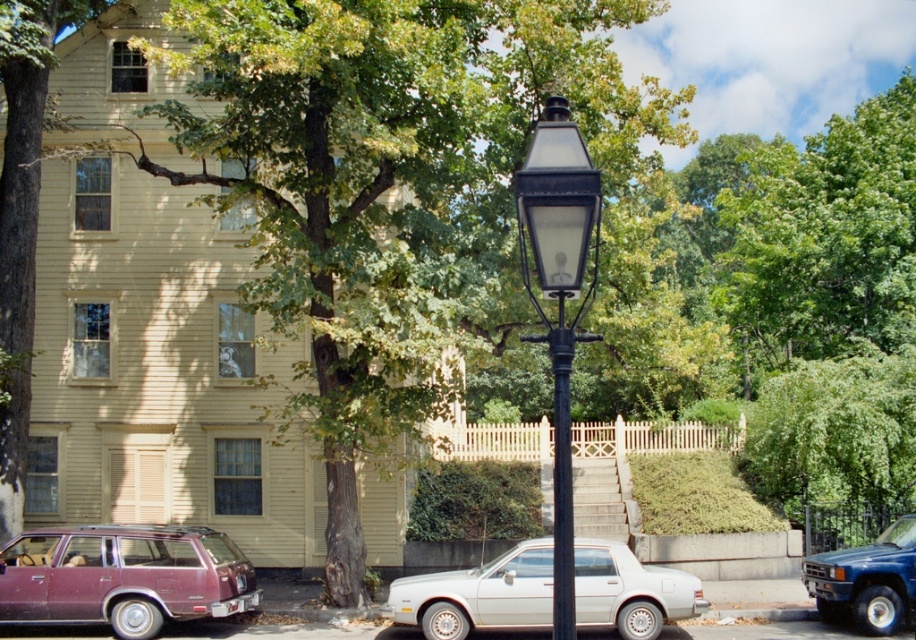
How much distance is there between white matte sedan at center and black glass street light at center?

3.20 meters

Is white matte sedan at center shorter than black glass street light at center?

Yes.

The width and height of the screenshot is (916, 640). Describe the element at coordinates (478, 595) in the screenshot. I see `white matte sedan at center` at that location.

Find the location of a particular element. Image resolution: width=916 pixels, height=640 pixels. white matte sedan at center is located at coordinates (478, 595).

Does white matte sedan at center appear on the right side of black metal streetlight at center?

Incorrect, white matte sedan at center is not on the right side of black metal streetlight at center.

Does point (673, 592) lie in front of point (563, 362)?

No, it is not.

Which is behind, point (427, 596) or point (560, 376)?

Positioned behind is point (427, 596).

Locate an element on the screen. The height and width of the screenshot is (640, 916). white matte sedan at center is located at coordinates (478, 595).

Between black glass street light at center and blue metallic suv at lower right, which one is positioned lower?

Positioned lower is blue metallic suv at lower right.

Which is behind, point (564, 168) or point (849, 598)?

The point (849, 598) is more distant.

At what (x,y) coordinates should I click in order to perform the action: click on black glass street light at center. Please return your answer as a coordinate pair (x, y). This screenshot has height=640, width=916. Looking at the image, I should click on (559, 298).